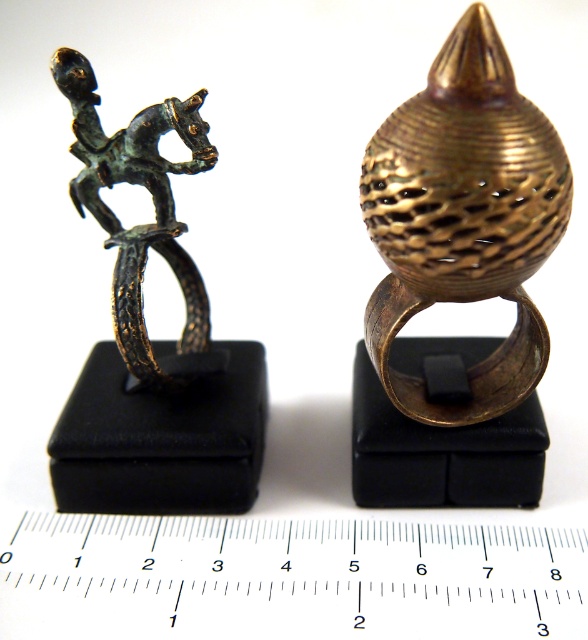
Between point (544, 346) and point (166, 211), which one is positioned behind?

Point (544, 346)

Does gold textured ring at center have a lesser width compared to bronze figure at left?

In fact, gold textured ring at center might be wider than bronze figure at left.

Is point (472, 68) positioned in front of point (116, 164)?

Yes, point (472, 68) is closer to viewer.

This screenshot has height=640, width=588. What are the coordinates of `gold textured ring at center` in the screenshot? It's located at (463, 216).

Does metallic ruler at center have a smaller size compared to gold textured ring at center?

Yes, metallic ruler at center is smaller than gold textured ring at center.

Is metallic ruler at center in front of gold textured ring at center?

No, metallic ruler at center is behind gold textured ring at center.

Which is behind, point (326, 563) or point (527, 307)?

Point (326, 563)

The image size is (588, 640). I want to click on metallic ruler at center, so click(x=288, y=577).

Is metallic ruler at center below bronze figure at left?

Yes, metallic ruler at center is below bronze figure at left.

Does metallic ruler at center have a lesser width compared to bronze figure at left?

No, metallic ruler at center is not thinner than bronze figure at left.

Where is `metallic ruler at center`? This screenshot has height=640, width=588. metallic ruler at center is located at coordinates (288, 577).

Locate an element on the screen. Image resolution: width=588 pixels, height=640 pixels. metallic ruler at center is located at coordinates (288, 577).